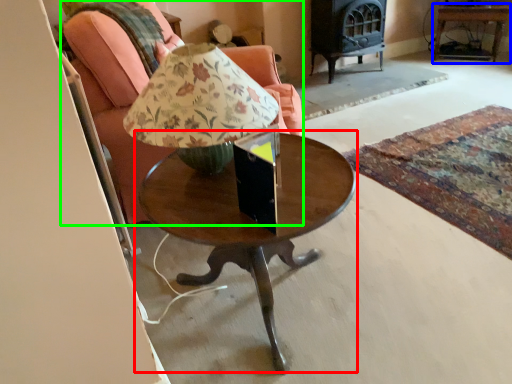
Question: Based on their relative distances, which object is nearer to coffee table (highlighted by a red box)? Choose from side table (highlighted by a blue box) and chair (highlighted by a green box).

Choices:
 (A) side table
 (B) chair

Answer: (B)